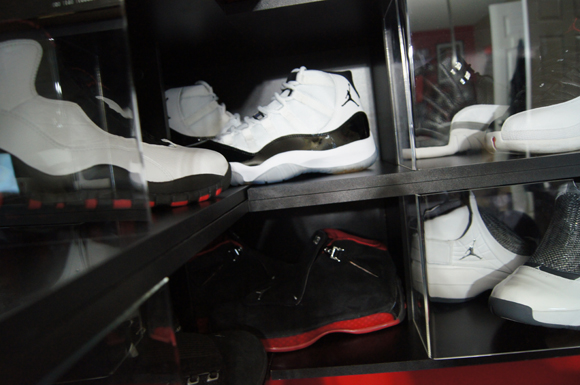
Locate an element on the screen. plastic boxes is located at coordinates (449, 341), (438, 27).